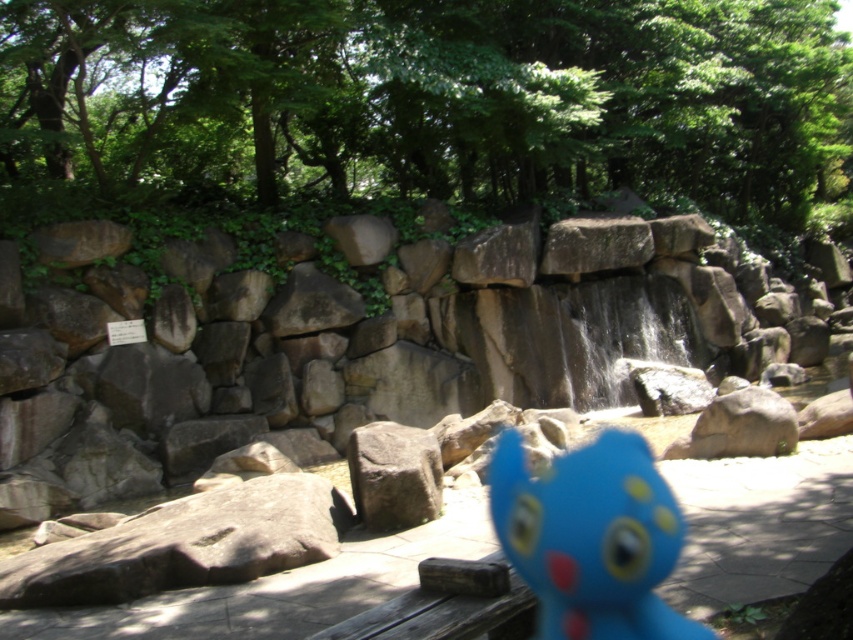
You are a hiker who wants to take a photo of the blue rubber toy at center. You need to position yourself so that the green leafy tree at upper center appears in the background. Is this possible given their positions?

Yes, because the green leafy tree at upper center is above the blue rubber toy at center, positioning yourself in front of the blue rubber toy at center would naturally place the tree in the background.

You are standing in the park and see the green leafy tree at upper center. What is the exact coordinate of the tree?

The green leafy tree at upper center is located at point (436, 97).